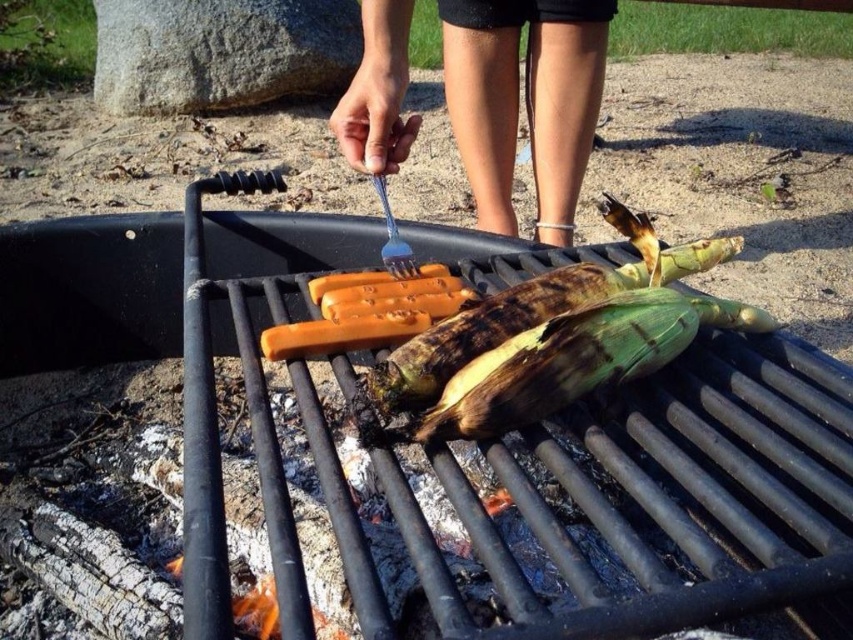
Question: Does black matte grill at center have a greater width compared to skinny blue plastic fork at upper center?

Choices:
 (A) no
 (B) yes

Answer: (B)

Question: Can you confirm if black matte grill at center is positioned below blue plastic fork at center?

Choices:
 (A) yes
 (B) no

Answer: (A)

Question: Which of the following is the closest to the observer?

Choices:
 (A) (604, 42)
 (B) (624, 252)

Answer: (B)

Question: Which of the following is the closest to the observer?

Choices:
 (A) (408, 141)
 (B) (212, 444)

Answer: (B)

Question: Can you confirm if skinny blue plastic fork at upper center is thinner than blue plastic fork at center?

Choices:
 (A) no
 (B) yes

Answer: (A)

Question: Which point is closer to the camera?

Choices:
 (A) charred corn at center
 (B) blue plastic fork at center

Answer: (A)